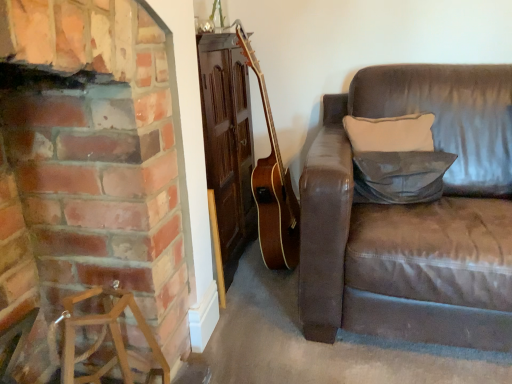
What do you see at coordinates (400, 176) in the screenshot?
I see `dark gray fabric pillow at center` at bounding box center [400, 176].

Identify the location of dark gray fabric pillow at center. (400, 176).

Image resolution: width=512 pixels, height=384 pixels. What are the coordinates of `dark gray fabric pillow at center` in the screenshot? It's located at (400, 176).